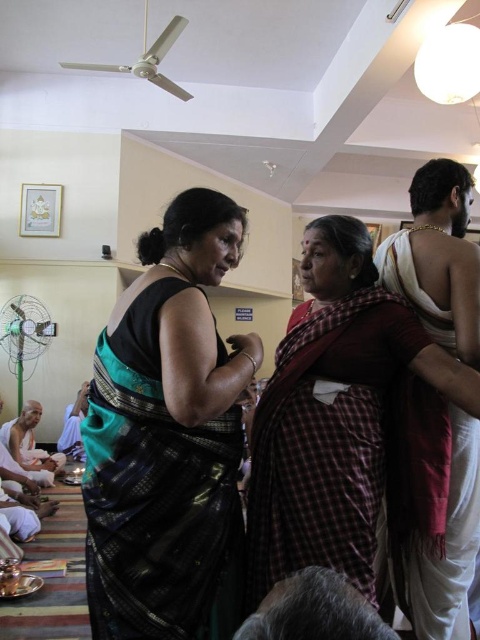
Can you confirm if black silk saree at center is thinner than red plaid sari at center?

Correct, black silk saree at center's width is less than red plaid sari at center's.

Does black silk saree at center have a greater width compared to red plaid sari at center?

Incorrect, black silk saree at center's width does not surpass red plaid sari at center's.

Between point (197, 636) and point (358, 401), which one is positioned behind?

Point (358, 401)

In order to click on black silk saree at center in this screenshot , I will do `click(166, 432)`.